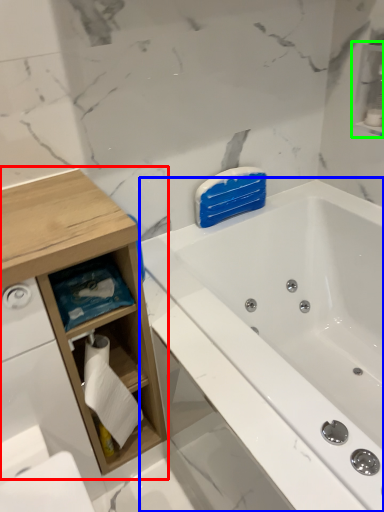
Question: Estimate the real-world distances between objects in this image. Which object is closer to cabinetry (highlighted by a red box), bathtub (highlighted by a blue box) or cabinet (highlighted by a green box)?

Choices:
 (A) bathtub
 (B) cabinet

Answer: (A)